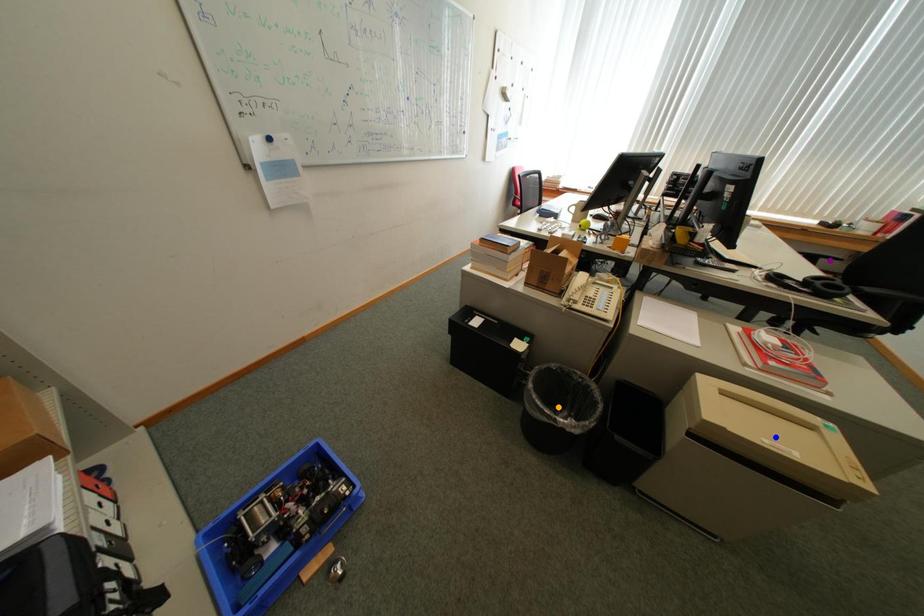
Order these from farthest to nearest:
1. blue point
2. orange point
3. purple point

purple point
orange point
blue point